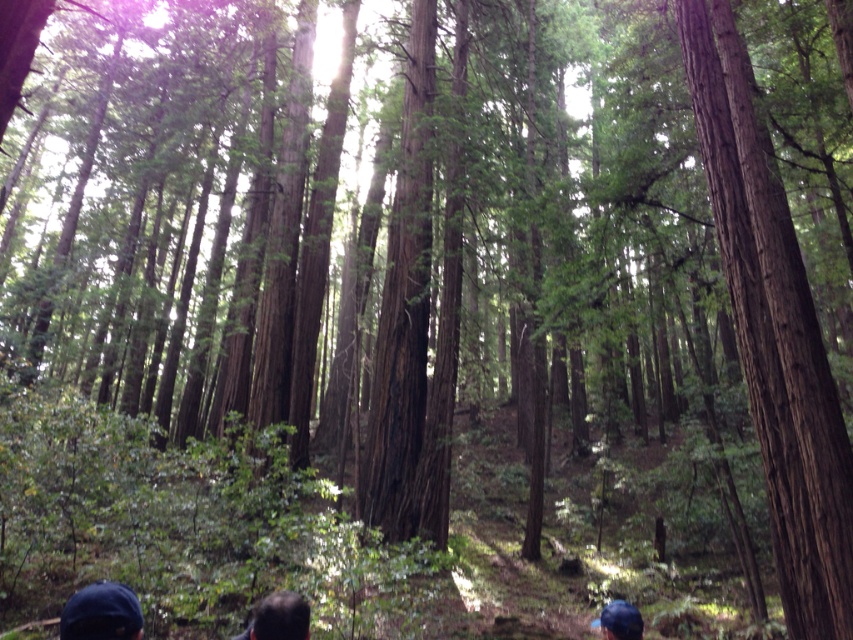
You are standing in a forest and see a dark blue fabric cap at lower left. If you want to locate it precisely, where would it be relative to your viewpoint?

The dark blue fabric cap at lower left is located at coordinates point (x=102, y=612) relative to your viewpoint.

You are standing in the forest and want to take a photo of the two points marked in the scene. Which point, point (115, 620) or point (270, 630), will appear larger in your camera view?

Point (115, 620) is closer to the camera than point (270, 630), so it will appear larger in the camera view.